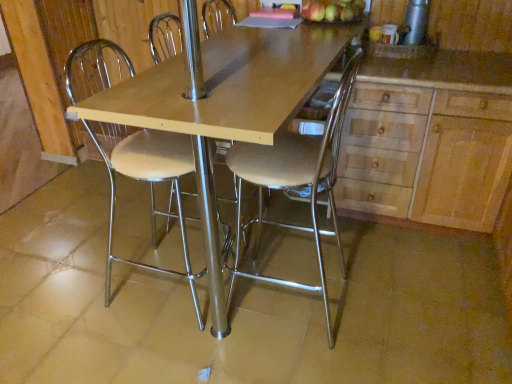
Find the location of `free point below metallic silver stool at center, which is the second chair in right-to-left order (from a real-world perspective)`. free point below metallic silver stool at center, which is the second chair in right-to-left order (from a real-world perspective) is located at coordinates (157, 279).